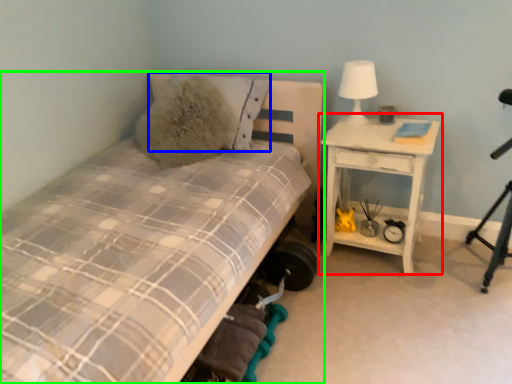
Question: Which is nearer to the nightstand (highlighted by a red box)? pillow (highlighted by a blue box) or bed (highlighted by a green box).

Choices:
 (A) pillow
 (B) bed

Answer: (A)